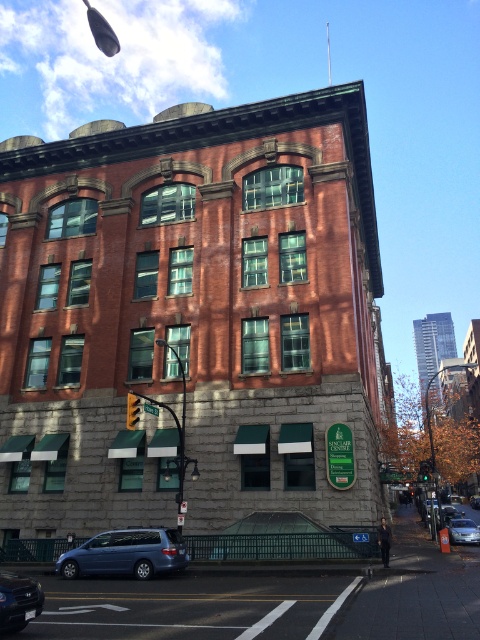
Based on the photo, you are standing at the entrance of the Sinclair Center and want to park your car. The parking lot has a designated spot at coordinates point 0.941, 0.037. Can you determine the location of the matte black sedan at lower left relative to this spot?

The matte black sedan at lower left is located exactly at the designated parking spot at point (17,602), so it is currently occupying that spot.